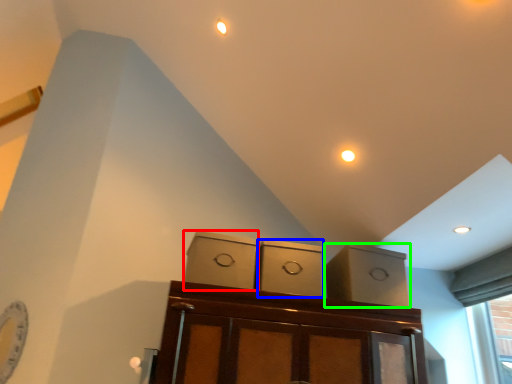
Question: Estimate the real-world distances between objects in this image. Which object is closer to cabinetry (highlighted by a red box), cabinetry (highlighted by a blue box) or cabinetry (highlighted by a green box)?

Choices:
 (A) cabinetry
 (B) cabinetry

Answer: (A)